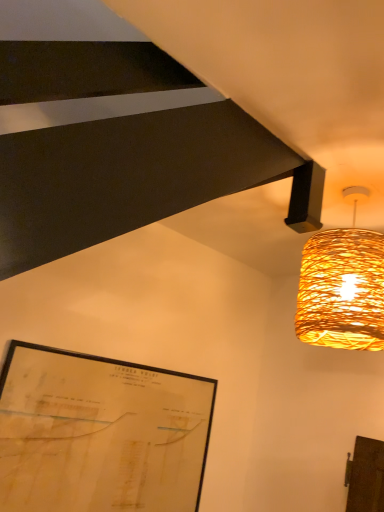
Locate an element on the screen. Image resolution: width=384 pixels, height=512 pixels. braided wicker lampshade at upper right is located at coordinates click(342, 287).

Describe the element at coordinates (342, 287) in the screenshot. I see `braided wicker lampshade at upper right` at that location.

Locate an element on the screen. The height and width of the screenshot is (512, 384). braided wicker lampshade at upper right is located at coordinates (342, 287).